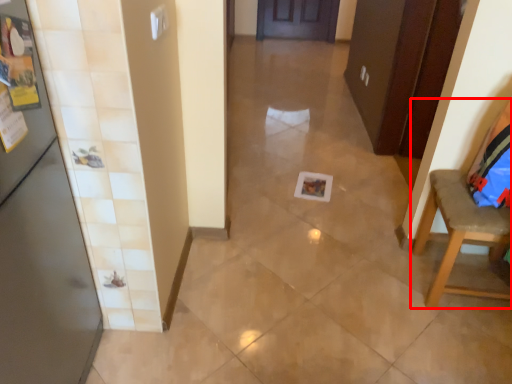
Question: Observing the image, what is the correct spatial positioning of chair (annotated by the red box) in reference to door?

Choices:
 (A) left
 (B) right

Answer: (B)